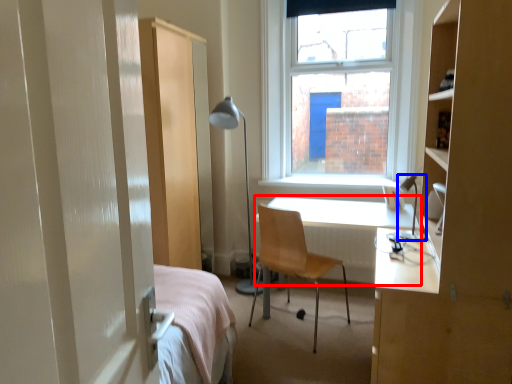
Question: Which of the following is the farthest to the observer, desk (highlighted by a red box) or table lamp (highlighted by a blue box)?

Choices:
 (A) desk
 (B) table lamp

Answer: (A)